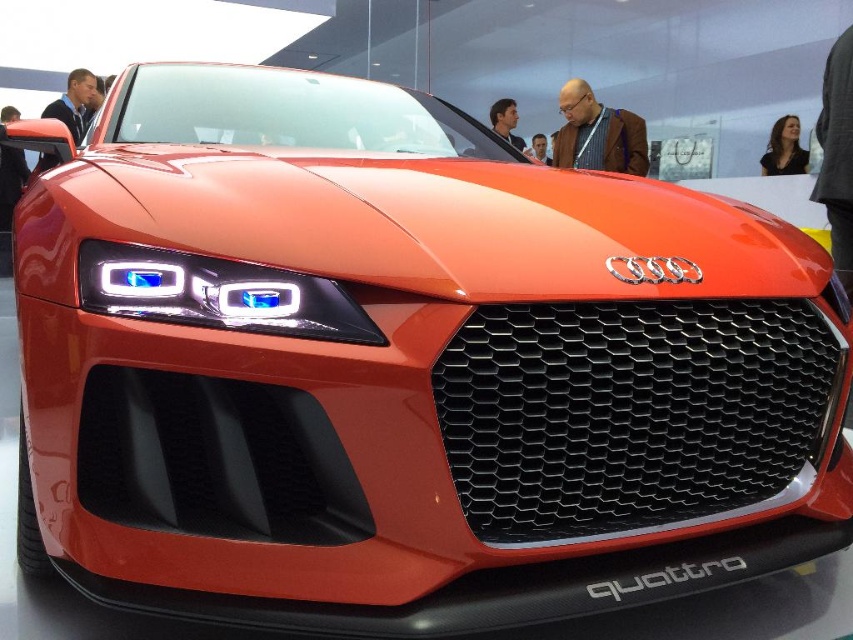
You are a photographer at the auto show and want to take a closeup shot of the matte plastic headlight at center. The headlight is located at point [218,292]. Where exactly should you position your camera to capture the headlight without any obstruction?

The matte plastic headlight at center is located at point [218,292]. To capture it without obstruction, position your camera directly facing this coordinate, ensuring no objects like the grille or other parts block the view.

You are a photographer at an auto show. You want to take a photo of the shiny orange car at center without including the matte plastic headlight at center in the frame. Based on their positions, is this possible?

The matte plastic headlight at center is positioned under the shiny orange car at center, so it is likely blocking part of the car. To avoid including the headlight, you might need to adjust your angle or position to capture only the upper part of the shiny orange car at center.

From the picture: You are standing at the front of the red Audi concept car and want to reach the point labeled point (764, 157). To get there, you have to pass through point (192, 314) first. Is this correct?

Yes, because point (192, 314) is in front of point (764, 157), so you must pass through it first to reach the latter.